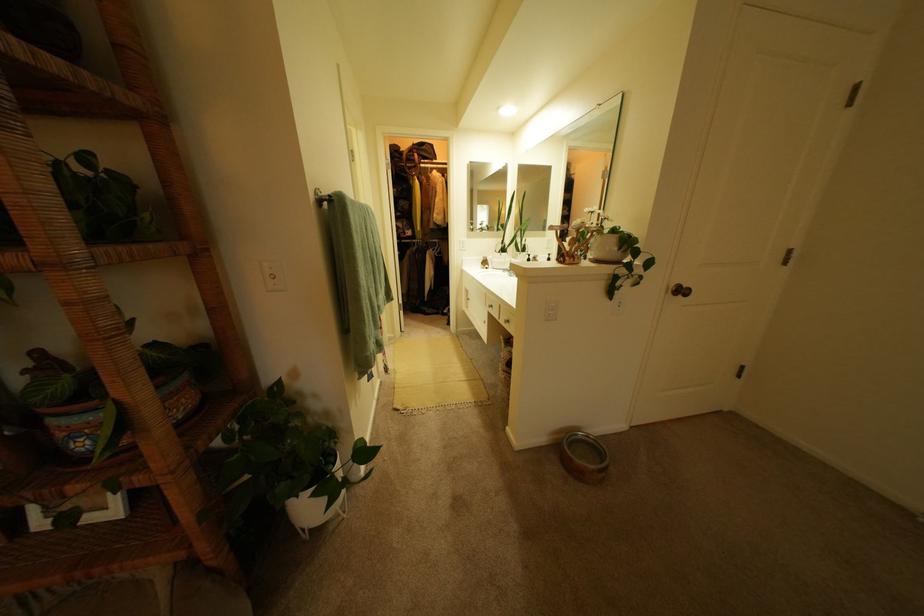
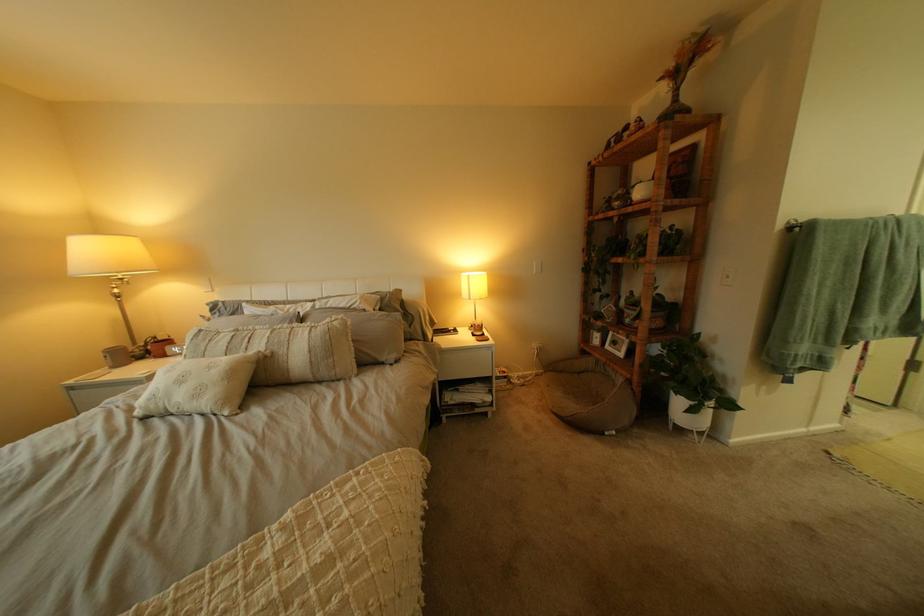
Locate, in the second image, the point that corresponds to (297,488) in the first image.

(687, 385)